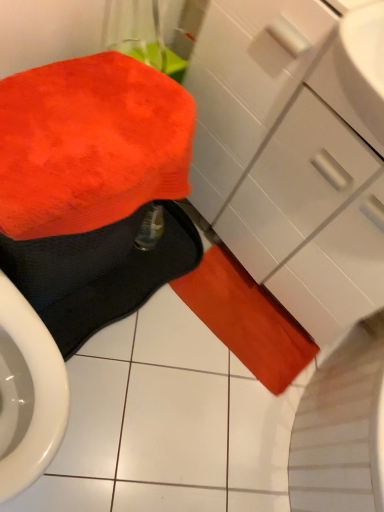
At what (x,y) coordinates should I click in order to perform the action: click on free point above fluffy orange towel at lower left, which is the first bath towel in front-to-back order (from a real-world perspective). Please return your answer as a coordinate pair (x, y). Looking at the image, I should click on (95, 118).